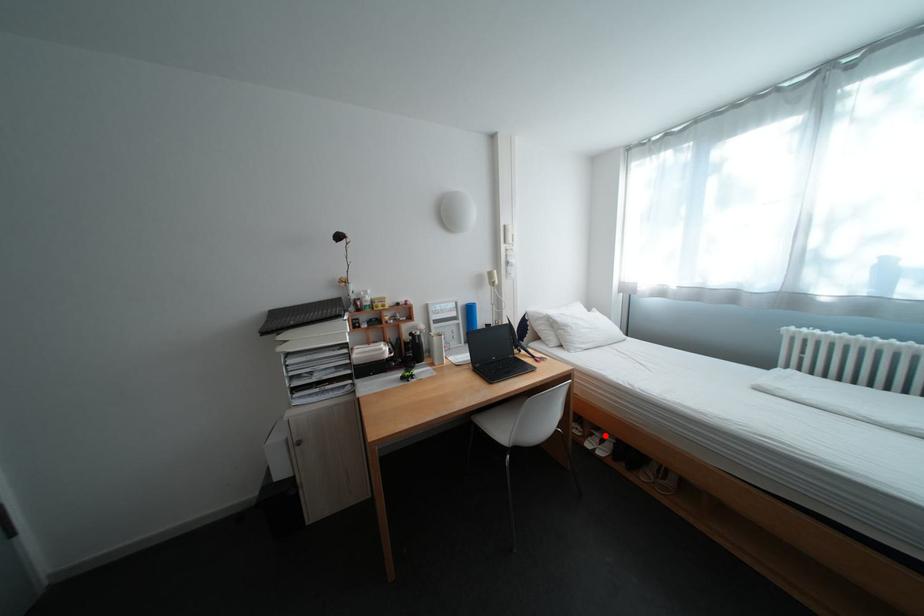
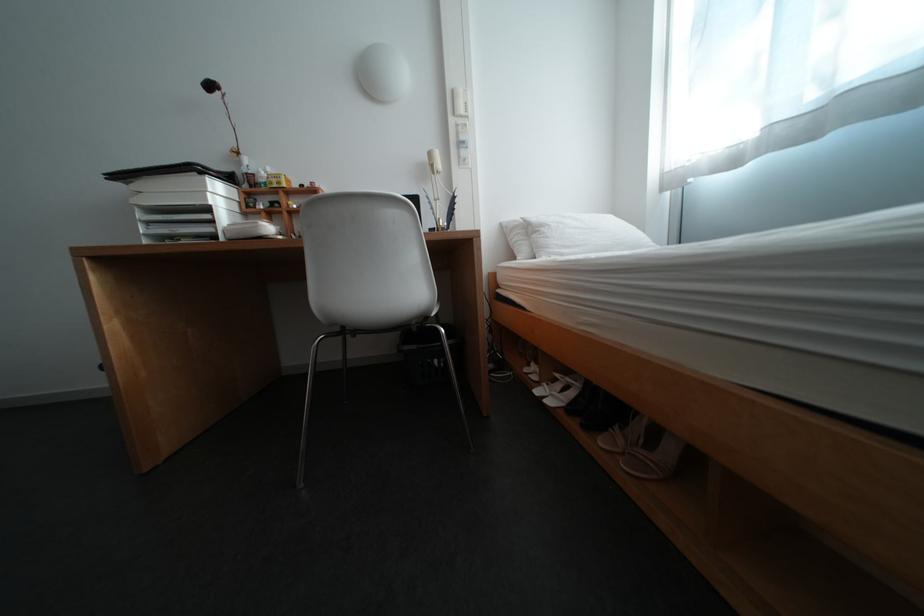
Question: I am providing you with two images of the same scene from different viewpoints. A red point is shown in image1. For the corresponding object point in image2, is it positioned nearer or farther from the camera?

Choices:
 (A) Nearer
 (B) Farther

Answer: (A)